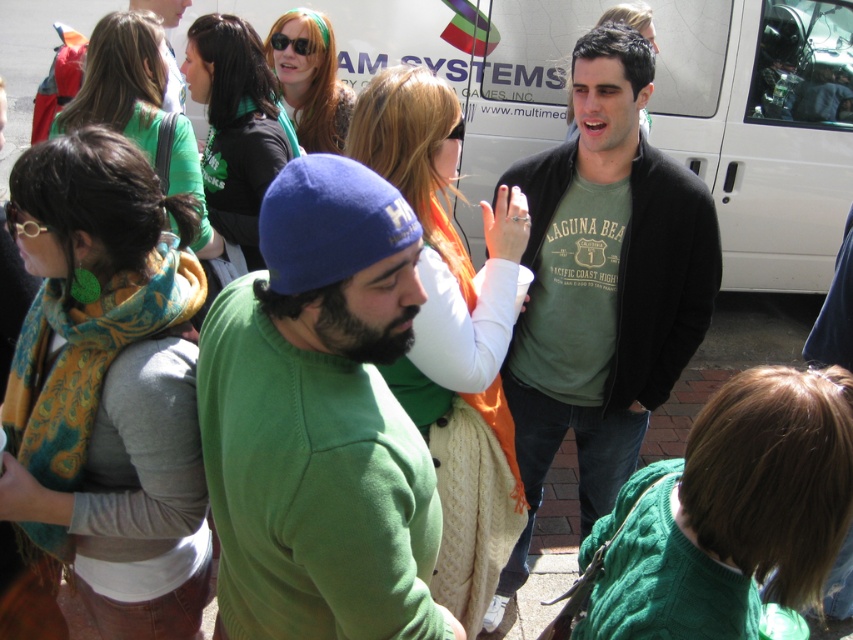
Question: Which point is closer to the camera?

Choices:
 (A) green cotton t-shirt at center
 (B) green matte sweatshirt at center

Answer: (A)

Question: Which object is positioned closest to the green fleece beanie at center?

Choices:
 (A) green matte sweatshirt at center
 (B) green cotton t-shirt at center

Answer: (A)

Question: Is green fleece beanie at center positioned before green matte sweatshirt at center?

Choices:
 (A) no
 (B) yes

Answer: (B)

Question: Observing the image, what is the correct spatial positioning of green fleece beanie at center in reference to green cotton t-shirt at center?

Choices:
 (A) below
 (B) above

Answer: (A)

Question: Which point is farther to the camera?

Choices:
 (A) green matte sweatshirt at center
 (B) green fleece beanie at center
 (C) green cotton t-shirt at center

Answer: (A)

Question: Does green fleece beanie at center have a greater width compared to green cotton t-shirt at center?

Choices:
 (A) no
 (B) yes

Answer: (A)